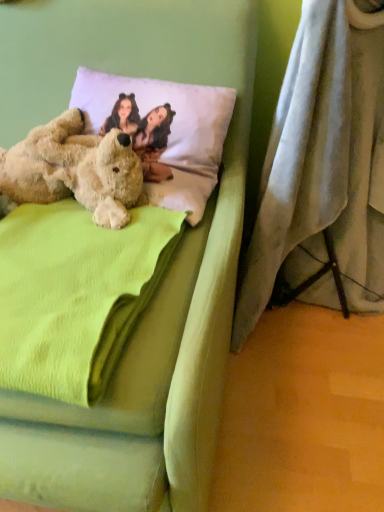
Question: From the image's perspective, is green fleece blanket at center positioned above or below fuzzy beige teddy bear at left?

Choices:
 (A) below
 (B) above

Answer: (A)

Question: In the image, is green fleece blanket at center positioned in front of or behind fuzzy beige teddy bear at left?

Choices:
 (A) front
 (B) behind

Answer: (A)

Question: Which of these objects is positioned farthest from the gray fabric curtain at lower right?

Choices:
 (A) white soft pillow at upper center
 (B) green fleece blanket at center
 (C) soft green fabric bed at center
 (D) fuzzy beige teddy bear at left

Answer: (B)

Question: Which object is the farthest from the gray fabric curtain at lower right?

Choices:
 (A) green fleece blanket at center
 (B) soft green fabric bed at center
 (C) white soft pillow at upper center
 (D) fuzzy beige teddy bear at left

Answer: (A)